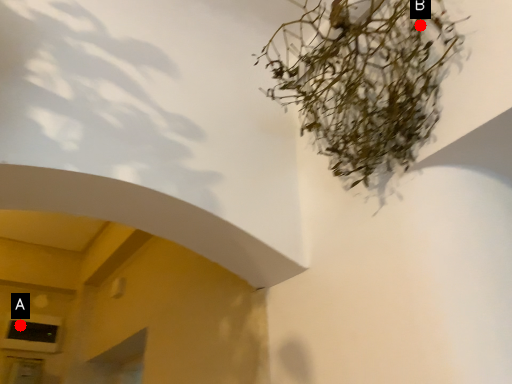
Question: Two points are circled on the image, labeled by A and B beside each circle. Among these points, which one is nearest to the camera?

Choices:
 (A) A is closer
 (B) B is closer

Answer: (B)